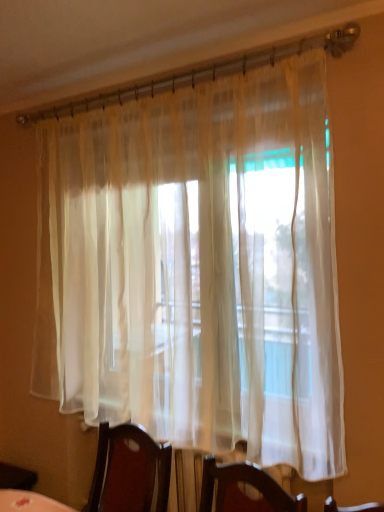
Locate an element on the screen. This screenshot has height=512, width=384. translucent white curtain at center is located at coordinates (197, 268).

What do you see at coordinates (197, 268) in the screenshot?
I see `translucent white curtain at center` at bounding box center [197, 268].

This screenshot has height=512, width=384. Identify the location of translucent white curtain at center. (197, 268).